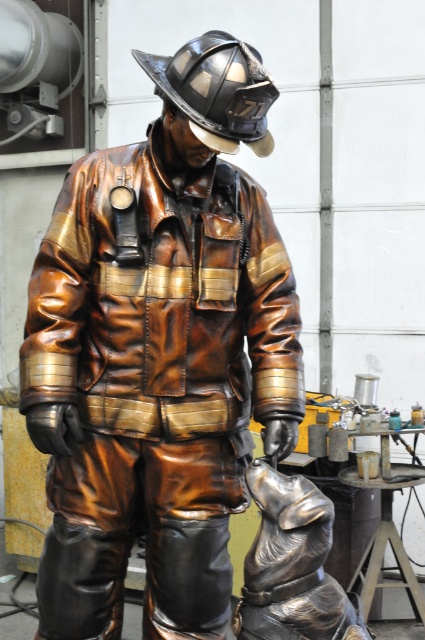
Question: Can you confirm if bronze statue at center is bigger than bronze/metallic boot at lower left?

Choices:
 (A) no
 (B) yes

Answer: (B)

Question: Which of these objects is positioned closest to the bronze statue at center?

Choices:
 (A) shiny black boot at lower center
 (B) shiny black helmet at center
 (C) bronze dog at lower center

Answer: (A)

Question: Estimate the real-world distances between objects in this image. Which object is closer to the shiny black helmet at center?

Choices:
 (A) bronze statue at center
 (B) shiny black boot at lower center
 (C) bronze dog at lower center

Answer: (A)

Question: Is bronze dog at lower center below shiny black boot at lower center?

Choices:
 (A) no
 (B) yes

Answer: (A)

Question: Which object is positioned farthest from the bronze/metallic boot at lower left?

Choices:
 (A) bronze statue at center
 (B) shiny black helmet at center

Answer: (B)

Question: Does bronze dog at lower center come behind shiny black helmet at center?

Choices:
 (A) no
 (B) yes

Answer: (A)